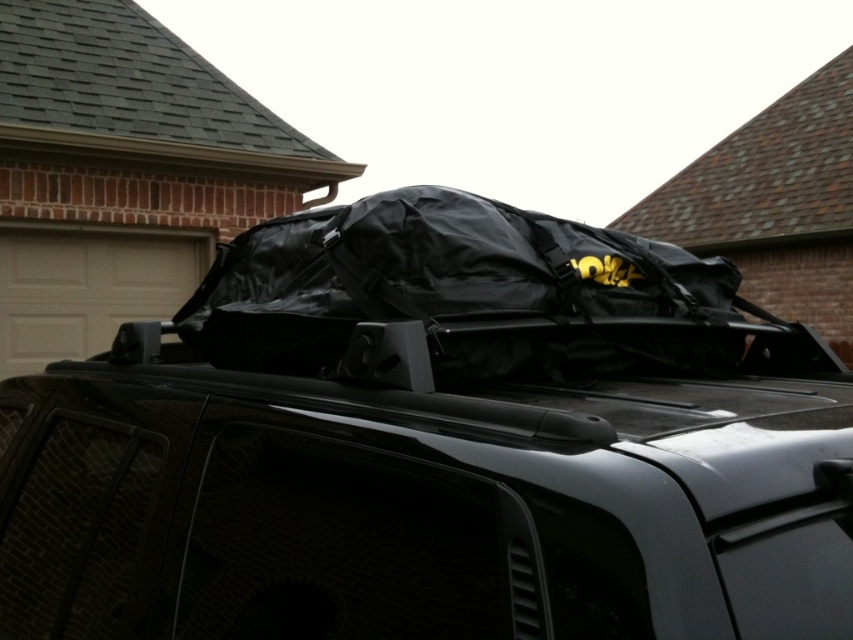
Question: Estimate the real-world distances between objects in this image. Which object is closer to the gray shingles at upper left?

Choices:
 (A) brown shingles at upper right
 (B) black rubberized bag at center

Answer: (B)

Question: Can you confirm if black rubberized bag at center is bigger than gray shingles at upper left?

Choices:
 (A) no
 (B) yes

Answer: (A)

Question: Does black rubberized bag at center appear on the left side of brown shingles at upper right?

Choices:
 (A) yes
 (B) no

Answer: (A)

Question: Among these objects, which one is nearest to the camera?

Choices:
 (A) brown shingles at upper right
 (B) black matte luggage at center
 (C) gray shingles at upper left

Answer: (B)

Question: Where is black matte luggage at center located in relation to brown shingles at upper right in the image?

Choices:
 (A) above
 (B) below

Answer: (B)

Question: Estimate the real-world distances between objects in this image. Which object is closer to the gray shingles at upper left?

Choices:
 (A) brown shingles at upper right
 (B) black matte luggage at center
 (C) black rubberized bag at center

Answer: (C)